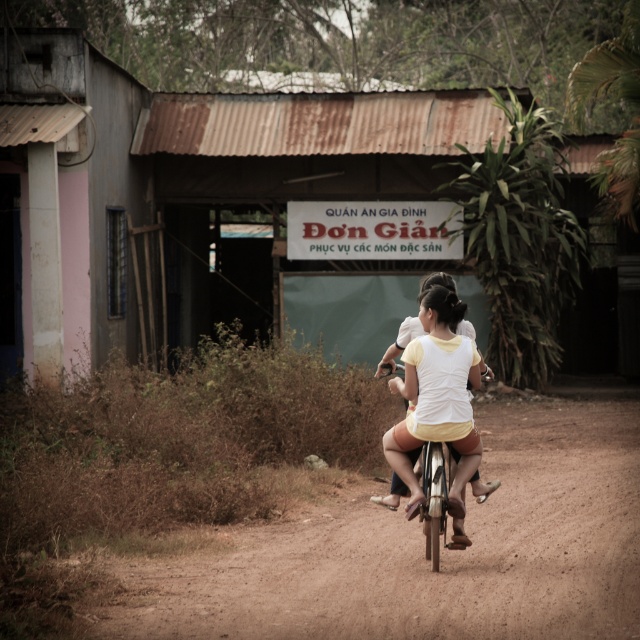
Question: Is rusty metal hut at center positioned in front of brown dirt track at center?

Choices:
 (A) yes
 (B) no

Answer: (B)

Question: Estimate the real-world distances between objects in this image. Which object is farther from the brown dirt track at center?

Choices:
 (A) white matte shirt at center
 (B) rusty metal hut at center

Answer: (B)

Question: Which object is closer to the camera taking this photo?

Choices:
 (A) white matte shirt at center
 (B) rusty metal hut at center

Answer: (A)

Question: Which object is positioned farthest from the white matte shirt at center?

Choices:
 (A) brown dirt track at center
 (B) rusty metal hut at center

Answer: (B)

Question: Does rusty metal hut at center have a greater width compared to brown dirt track at center?

Choices:
 (A) no
 (B) yes

Answer: (B)

Question: Is rusty metal hut at center above white matte shirt at center?

Choices:
 (A) yes
 (B) no

Answer: (A)